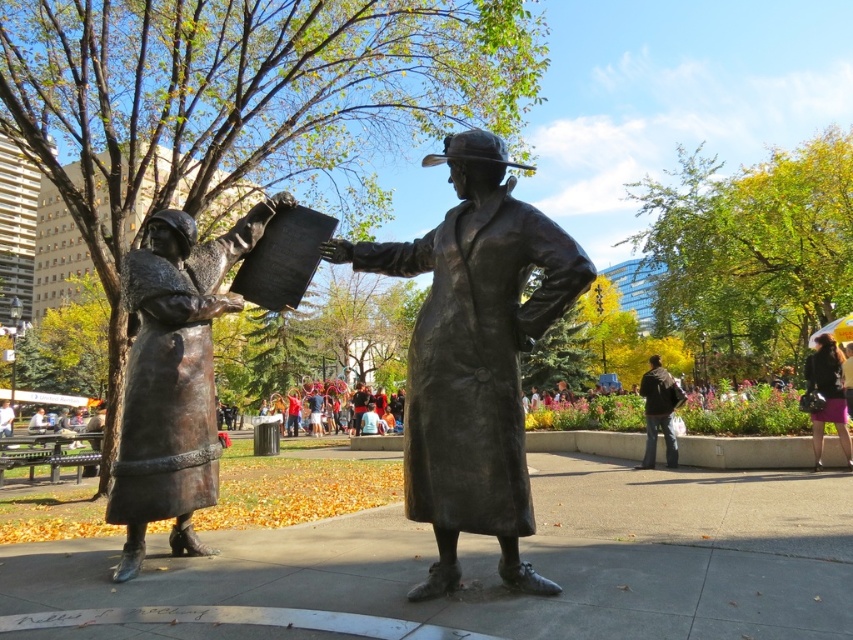
Question: Does matte black jacket at lower right have a lesser width compared to dark brown leather jacket at lower right?

Choices:
 (A) yes
 (B) no

Answer: (B)

Question: Which object appears closest to the camera in this image?

Choices:
 (A) matte black jacket at lower right
 (B) bronze statue at center
 (C) bronze statue at left

Answer: (B)

Question: Can you confirm if bronze statue at center is smaller than bronze statue at left?

Choices:
 (A) no
 (B) yes

Answer: (A)

Question: Is bronze statue at center smaller than bronze statue at left?

Choices:
 (A) yes
 (B) no

Answer: (B)

Question: Which of the following is the closest to the observer?

Choices:
 (A) (843, 401)
 (B) (148, 282)
 (C) (653, 444)
 (D) (425, 445)

Answer: (D)

Question: Among these points, which one is nearest to the camera?

Choices:
 (A) (668, 419)
 (B) (839, 365)
 (C) (154, 227)
 (D) (422, 324)

Answer: (D)